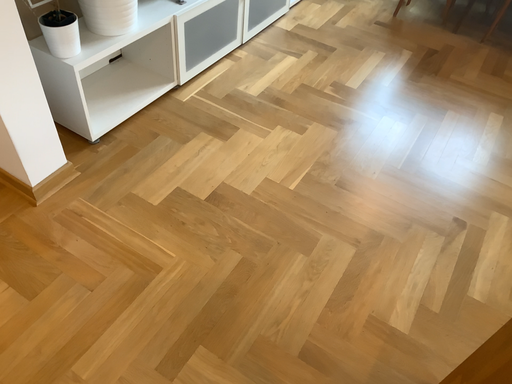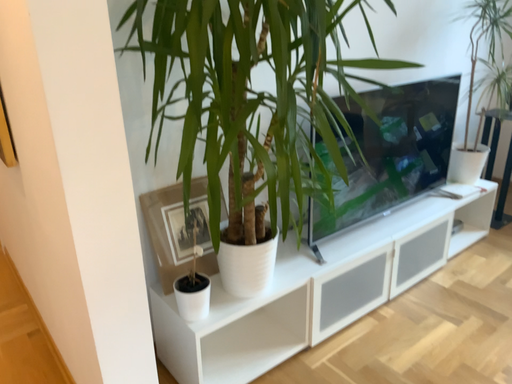
Question: Which way did the camera rotate in the video?

Choices:
 (A) rotated downward
 (B) rotated upward

Answer: (B)